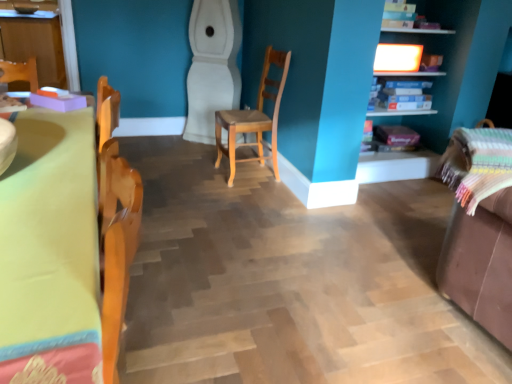
I want to click on blue cardboard boxes at upper right, which appears as the 2th shelf when viewed from the top, so click(404, 96).

Find the location of `yellow fabric table at left`. yellow fabric table at left is located at coordinates (50, 252).

Locate an element on the screen. matte wood cabinet at upper left is located at coordinates coord(37,45).

Where is `wooden chair at center`? wooden chair at center is located at coordinates coord(254,117).

This screenshot has height=384, width=512. What do you see at coordinates (254, 117) in the screenshot?
I see `wooden chair at center` at bounding box center [254, 117].

Measure the distance between point (407, 41) and camera.

Point (407, 41) and camera are 11.49 feet apart.

Image resolution: width=512 pixels, height=384 pixels. Identify the location of matte wooden shelf at upper right, which is the first shelf from top to bottom. (441, 66).

Where is `blue cardboard boxes at upper right, which appears as the 2th shelf when viewed from the top`? This screenshot has height=384, width=512. blue cardboard boxes at upper right, which appears as the 2th shelf when viewed from the top is located at coordinates (404, 96).

Is yellow fabric table at left at the left side of matte wooden shelf at upper right, which is counted as the 2th shelf, starting from the bottom?

Indeed, yellow fabric table at left is positioned on the left side of matte wooden shelf at upper right, which is counted as the 2th shelf, starting from the bottom.

Is matte wooden shelf at upper right, which is counted as the 2th shelf, starting from the bottom, at the back of yellow fabric table at left?

yellow fabric table at left is not turned away from matte wooden shelf at upper right, which is counted as the 2th shelf, starting from the bottom.

Which of these two, yellow fabric table at left or matte wooden shelf at upper right, which is the first shelf from top to bottom, is bigger?

yellow fabric table at left.

Can you confirm if yellow fabric table at left is wider than matte wooden shelf at upper right, which is the first shelf from top to bottom?

No.

From the image's perspective, would you say wooden chair at center is shown under yellow fabric table at left?

No.

Looking at their sizes, would you say wooden chair at center is wider or thinner than yellow fabric table at left?

In the image, wooden chair at center appears to be more narrow than yellow fabric table at left.

Does wooden chair at center turn towards yellow fabric table at left?

No, wooden chair at center is not facing towards yellow fabric table at left.

In terms of height, does wooden chair at center look taller or shorter compared to yellow fabric table at left?

Clearly, wooden chair at center is taller compared to yellow fabric table at left.

Consider the image. From a real-world perspective, is yellow fabric table at left positioned under brown leather swivel chair at right based on gravity?

Actually, yellow fabric table at left is physically above brown leather swivel chair at right in the real world.

Considering the relative sizes of yellow fabric table at left and brown leather swivel chair at right in the image provided, is yellow fabric table at left taller than brown leather swivel chair at right?

Yes.

Is yellow fabric table at left at the left side of brown leather swivel chair at right?

Yes, yellow fabric table at left is to the left of brown leather swivel chair at right.

Considering the relative positions of matte wooden shelf at upper right, which is counted as the 2th shelf, starting from the bottom, and brown leather swivel chair at right in the image provided, is matte wooden shelf at upper right, which is counted as the 2th shelf, starting from the bottom, to the right of brown leather swivel chair at right from the viewer's perspective?

No, matte wooden shelf at upper right, which is counted as the 2th shelf, starting from the bottom, is not to the right of brown leather swivel chair at right.

From the picture: From a real-world perspective, is matte wooden shelf at upper right, which is counted as the 2th shelf, starting from the bottom, on brown leather swivel chair at right?

Yes.

Looking at this image, between matte wooden shelf at upper right, which is counted as the 2th shelf, starting from the bottom, and brown leather swivel chair at right, which one has smaller size?

brown leather swivel chair at right.

Does matte wooden shelf at upper right, which is the first shelf from top to bottom, come in front of brown leather swivel chair at right?

No, it is behind brown leather swivel chair at right.

Based on the photo, does matte wood cabinet at upper left have a smaller size compared to wooden chair at center?

No.

Is matte wood cabinet at upper left touching wooden chair at center?

No, matte wood cabinet at upper left is not next to wooden chair at center.

In the scene shown: Is matte wood cabinet at upper left looking in the opposite direction of wooden chair at center?

No.

Considering the points (54, 76) and (239, 123), which point is behind, point (54, 76) or point (239, 123)?

Point (54, 76)

Can you confirm if wooden chair at center is wider than blue cardboard boxes at upper right, which appears as the 1th shelf when ordered from the bottom?

In fact, wooden chair at center might be narrower than blue cardboard boxes at upper right, which appears as the 1th shelf when ordered from the bottom.

Considering the positions of objects wooden chair at center and blue cardboard boxes at upper right, which appears as the 2th shelf when viewed from the top, in the image provided, who is in front, wooden chair at center or blue cardboard boxes at upper right, which appears as the 2th shelf when viewed from the top,?

wooden chair at center.

Can you confirm if wooden chair at center is positioned to the left of blue cardboard boxes at upper right, which appears as the 1th shelf when ordered from the bottom?

Yes, wooden chair at center is to the left of blue cardboard boxes at upper right, which appears as the 1th shelf when ordered from the bottom.

In terms of size, does wooden chair at center appear bigger or smaller than blue cardboard boxes at upper right, which appears as the 1th shelf when ordered from the bottom?

Clearly, wooden chair at center is larger in size than blue cardboard boxes at upper right, which appears as the 1th shelf when ordered from the bottom.

Image resolution: width=512 pixels, height=384 pixels. I want to click on cabinetry located behind the brown leather swivel chair at right, so click(x=37, y=45).

Is brown leather swivel chair at right at the left side of matte wood cabinet at upper left?

No, brown leather swivel chair at right is not to the left of matte wood cabinet at upper left.

Can you confirm if brown leather swivel chair at right is smaller than matte wood cabinet at upper left?

Indeed, brown leather swivel chair at right has a smaller size compared to matte wood cabinet at upper left.

Is brown leather swivel chair at right taller than matte wood cabinet at upper left?

In fact, brown leather swivel chair at right may be shorter than matte wood cabinet at upper left.

Where is `the 1st shelf to the right when counting from the yellow fabric table at left`? This screenshot has width=512, height=384. the 1st shelf to the right when counting from the yellow fabric table at left is located at coordinates (441, 66).

Locate an element on the screen. table in front of the wooden chair at center is located at coordinates (50, 252).

Estimate the real-world distances between objects in this image. Which object is further from matte wooden shelf at upper right, which is counted as the 2th shelf, starting from the bottom, yellow fabric table at left or wooden chair at center?

Based on the image, yellow fabric table at left appears to be further to matte wooden shelf at upper right, which is counted as the 2th shelf, starting from the bottom.

Looking at the image, which one is located closer to matte wooden shelf at upper right, which is counted as the 2th shelf, starting from the bottom, wooden chair at center or blue cardboard boxes at upper right, which appears as the 1th shelf when ordered from the bottom?

The object closer to matte wooden shelf at upper right, which is counted as the 2th shelf, starting from the bottom, is blue cardboard boxes at upper right, which appears as the 1th shelf when ordered from the bottom.

From the image, which object appears to be farther from matte wood cabinet at upper left, yellow fabric table at left or blue cardboard boxes at upper right, which appears as the 1th shelf when ordered from the bottom?

Among the two, yellow fabric table at left is located further to matte wood cabinet at upper left.

Based on their spatial positions, is matte wooden shelf at upper right, which is counted as the 2th shelf, starting from the bottom, or wooden chair at center further from brown leather swivel chair at right?

matte wooden shelf at upper right, which is counted as the 2th shelf, starting from the bottom, lies further to brown leather swivel chair at right than the other object.

When comparing their distances from yellow fabric table at left, does wooden chair at center or matte wood cabinet at upper left seem closer?

wooden chair at center lies closer to yellow fabric table at left than the other object.

Which object lies nearer to the anchor point yellow fabric table at left, wooden chair at center or matte wooden shelf at upper right, which is counted as the 2th shelf, starting from the bottom?

wooden chair at center is closer to yellow fabric table at left.

Looking at the image, which one is located further to matte wood cabinet at upper left, blue cardboard boxes at upper right, which appears as the 1th shelf when ordered from the bottom, or matte wooden shelf at upper right, which is the first shelf from top to bottom?

matte wooden shelf at upper right, which is the first shelf from top to bottom, lies further to matte wood cabinet at upper left than the other object.

Which object lies nearer to the anchor point brown leather swivel chair at right, matte wooden shelf at upper right, which is counted as the 2th shelf, starting from the bottom, or blue cardboard boxes at upper right, which appears as the 1th shelf when ordered from the bottom?

Among the two, blue cardboard boxes at upper right, which appears as the 1th shelf when ordered from the bottom, is located nearer to brown leather swivel chair at right.

Where is `swivel chair between yellow fabric table at left and blue cardboard boxes at upper right, which appears as the 1th shelf when ordered from the bottom, along the z-axis`? swivel chair between yellow fabric table at left and blue cardboard boxes at upper right, which appears as the 1th shelf when ordered from the bottom, along the z-axis is located at coordinates (480, 262).

This screenshot has height=384, width=512. I want to click on chair located between matte wood cabinet at upper left and matte wooden shelf at upper right, which is the first shelf from top to bottom, in the left-right direction, so click(x=254, y=117).

I want to click on shelf between matte wood cabinet at upper left and blue cardboard boxes at upper right, which appears as the 1th shelf when ordered from the bottom, so click(x=441, y=66).

Identify the location of shelf between brown leather swivel chair at right and wooden chair at center from front to back. The width and height of the screenshot is (512, 384). (441, 66).